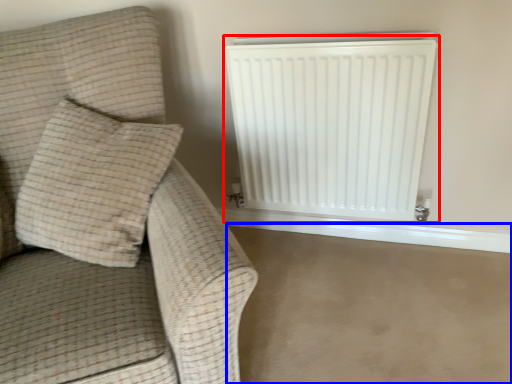
Question: Which of the following is the closest to the observer, radiator (highlighted by a red box) or concrete (highlighted by a blue box)?

Choices:
 (A) radiator
 (B) concrete

Answer: (B)